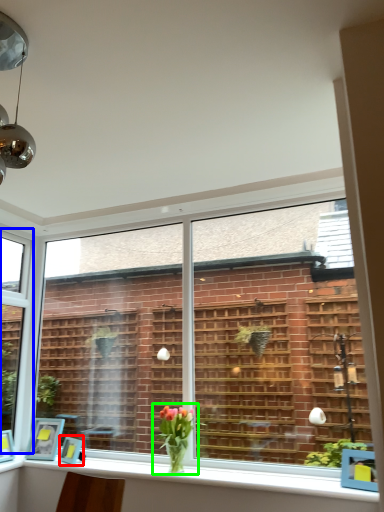
Question: Based on their relative distances, which object is nearer to picture frame (highlighted by a red box)? Choose from window (highlighted by a blue box) and houseplant (highlighted by a green box).

Choices:
 (A) window
 (B) houseplant

Answer: (B)